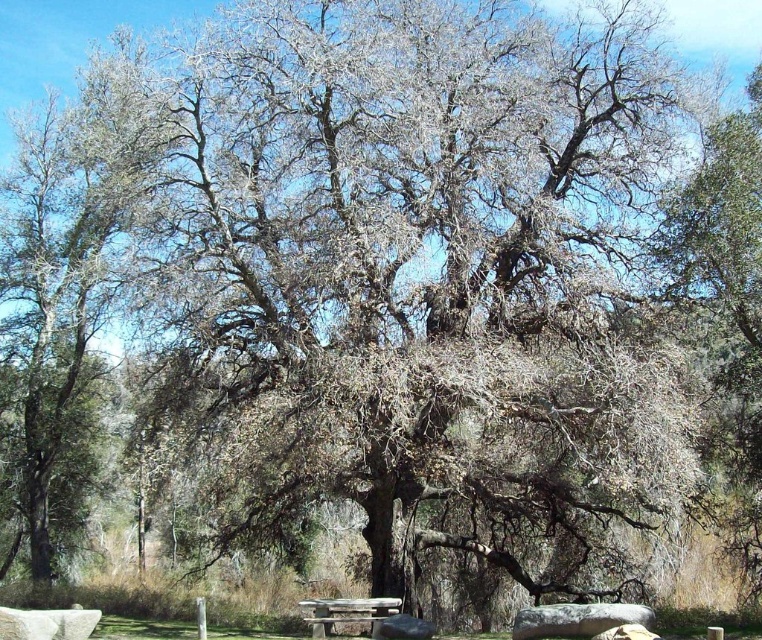
Question: Can you confirm if grayish-brown bark tree at center is positioned to the right of wooden picnic table at center?

Choices:
 (A) no
 (B) yes

Answer: (A)

Question: Does grayish-brown bark tree at center lie in front of wooden picnic table at center?

Choices:
 (A) no
 (B) yes

Answer: (A)

Question: Which object is farther from the camera taking this photo?

Choices:
 (A) grayish-brown bark tree at center
 (B) wooden picnic table at center

Answer: (A)

Question: Which object is closer to the camera taking this photo?

Choices:
 (A) grayish-brown bark tree at center
 (B) wooden picnic table at center

Answer: (B)

Question: Is grayish-brown bark tree at center smaller than wooden picnic table at center?

Choices:
 (A) yes
 (B) no

Answer: (B)